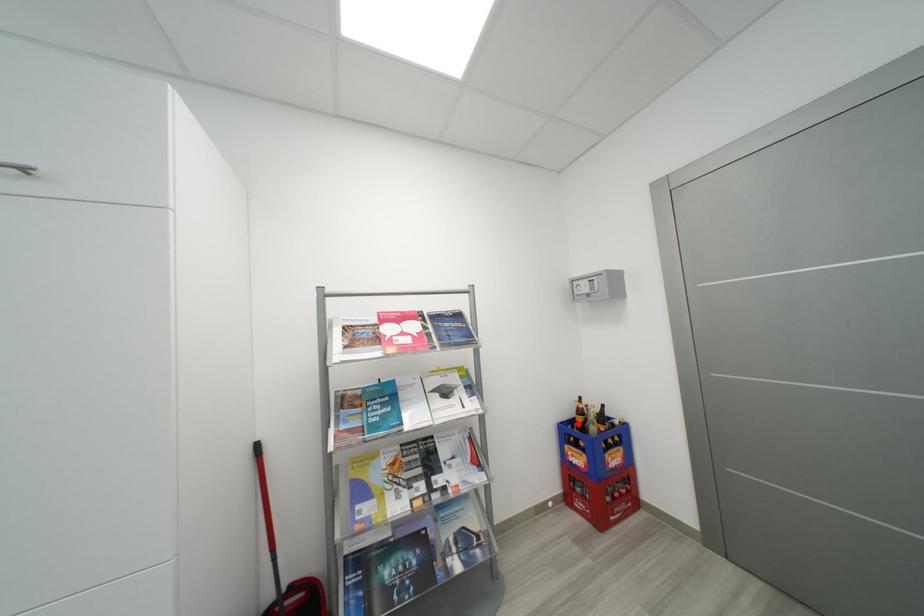
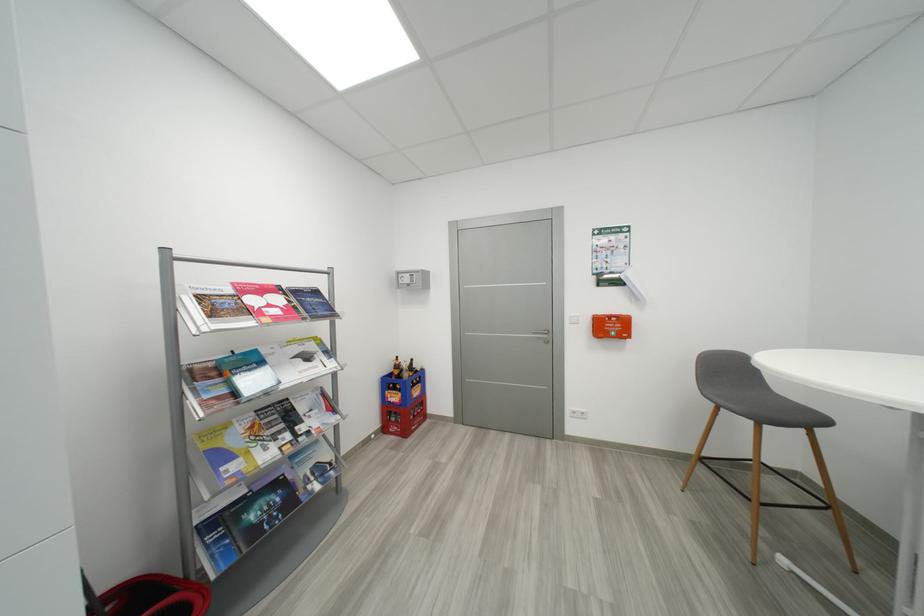
Question: I am providing you with two images of the same scene from different viewpoints. Image1 has a red point marked. In image2, the corresponding 3D location appears at what relative position? Reply with the corresponding letter.

Choices:
 (A) Closer
 (B) Farther

Answer: (B)